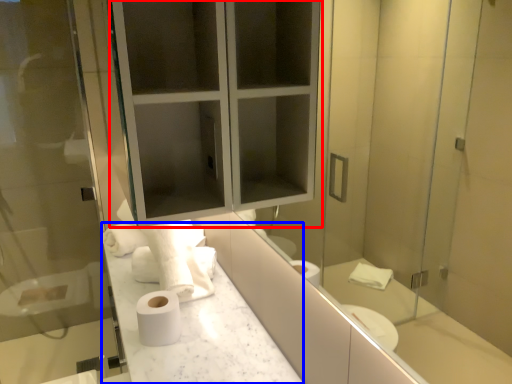
Question: Among these objects, which one is nearest to the camera, medicine cabinet (highlighted by a red box) or counter top (highlighted by a blue box)?

Choices:
 (A) medicine cabinet
 (B) counter top

Answer: (A)